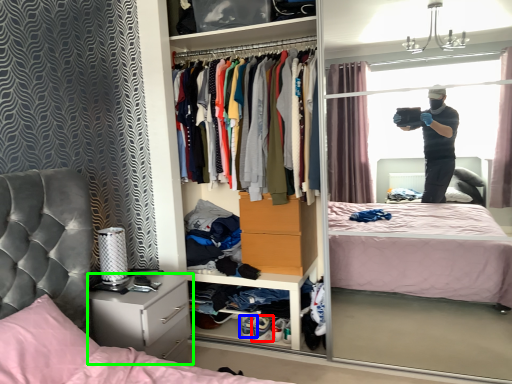
Question: Estimate the real-world distances between objects in this image. Which object is closer to footwear (highlighted by a red box), footwear (highlighted by a blue box) or cabinetry (highlighted by a green box)?

Choices:
 (A) footwear
 (B) cabinetry

Answer: (A)